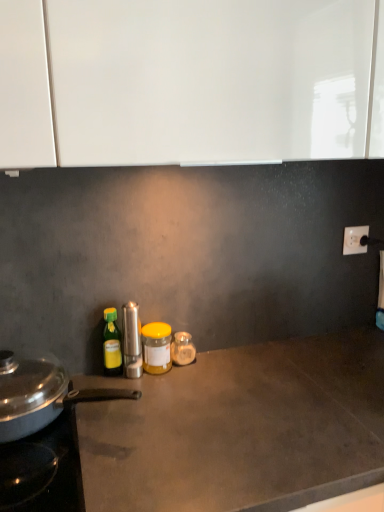
What do you see at coordinates (235, 430) in the screenshot? I see `matte gray countertop at center` at bounding box center [235, 430].

Measure the distance between white plastic electric outlet at upper right and camera.

The distance of white plastic electric outlet at upper right from camera is 4.56 feet.

Identify the location of green plastic bottle at left, the 1th bottle viewed from the left. (111, 343).

From a real-world perspective, is satin silver pepper mill at center, the 1th kitchen appliance positioned from the right, located beneath translucent glass jar at center, arranged as the third bottle when viewed from the left?

Actually, satin silver pepper mill at center, the 1th kitchen appliance positioned from the right, is physically above translucent glass jar at center, arranged as the third bottle when viewed from the left, in the real world.

Is satin silver pepper mill at center, the 2th kitchen appliance in the left-to-right sequence, situated inside translucent glass jar at center, marked as the first bottle in a right-to-left arrangement, or outside?

satin silver pepper mill at center, the 2th kitchen appliance in the left-to-right sequence, is outside translucent glass jar at center, marked as the first bottle in a right-to-left arrangement.

Could you tell me if satin silver pepper mill at center, the 2th kitchen appliance in the left-to-right sequence, is turned towards translucent glass jar at center, marked as the first bottle in a right-to-left arrangement?

No, satin silver pepper mill at center, the 2th kitchen appliance in the left-to-right sequence, is not oriented towards translucent glass jar at center, marked as the first bottle in a right-to-left arrangement.

Is yellow matte jar at center, which is the 2th bottle from right to left, at the back of translucent glass jar at center, marked as the first bottle in a right-to-left arrangement?

No, translucent glass jar at center, marked as the first bottle in a right-to-left arrangement, is not facing the opposite direction of yellow matte jar at center, which is the 2th bottle from right to left.

Looking at the image, does translucent glass jar at center, arranged as the third bottle when viewed from the left, seem bigger or smaller compared to yellow matte jar at center, which ranks as the second bottle in left-to-right order?

Clearly, translucent glass jar at center, arranged as the third bottle when viewed from the left, is smaller in size than yellow matte jar at center, which ranks as the second bottle in left-to-right order.

Is point (182, 358) positioned behind point (147, 340)?

Yes.

In the scene shown: Is the surface of metallic silver pan at left, the 2th kitchen appliance viewed from the right, in direct contact with white plastic electric outlet at upper right?

They are not placed beside each other.

From the image's perspective, which is above, metallic silver pan at left, which appears as the first kitchen appliance when viewed from the left, or white plastic electric outlet at upper right?

From the image's view, white plastic electric outlet at upper right is above.

Is metallic silver pan at left, the 2th kitchen appliance viewed from the right, positioned with its back to white plastic electric outlet at upper right?

No, metallic silver pan at left, the 2th kitchen appliance viewed from the right, is not facing away from white plastic electric outlet at upper right.

Is metallic silver pan at left, the 2th kitchen appliance viewed from the right, located outside white plastic electric outlet at upper right?

Yes.

Starting from the satin silver pepper mill at center, the 1th kitchen appliance positioned from the right, which bottle is the 1st one to the right? Please provide its 2D coordinates.

[(156, 347)]

Between satin silver pepper mill at center, the 1th kitchen appliance positioned from the right, and yellow matte jar at center, which ranks as the second bottle in left-to-right order, which one has larger width?

yellow matte jar at center, which ranks as the second bottle in left-to-right order, is wider.

Is satin silver pepper mill at center, the 1th kitchen appliance positioned from the right, inside or outside of yellow matte jar at center, which is the 2th bottle from right to left?

The correct answer is: outside.

Consider the image. From the image's perspective, is metallic silver pan at left, the 2th kitchen appliance viewed from the right, below matte gray countertop at center?

No, from the image's perspective, metallic silver pan at left, the 2th kitchen appliance viewed from the right, is not beneath matte gray countertop at center.

Where is `countertop that appears in front of the metallic silver pan at left, the 2th kitchen appliance viewed from the right`? The width and height of the screenshot is (384, 512). countertop that appears in front of the metallic silver pan at left, the 2th kitchen appliance viewed from the right is located at coordinates (235, 430).

Considering the relative sizes of metallic silver pan at left, the 2th kitchen appliance viewed from the right, and matte gray countertop at center in the image provided, is metallic silver pan at left, the 2th kitchen appliance viewed from the right, taller than matte gray countertop at center?

No, metallic silver pan at left, the 2th kitchen appliance viewed from the right, is not taller than matte gray countertop at center.

Is white plastic electric outlet at upper right at the back of yellow matte jar at center, which ranks as the second bottle in left-to-right order?

No, yellow matte jar at center, which ranks as the second bottle in left-to-right order, is not facing away from white plastic electric outlet at upper right.

From a real-world perspective, between yellow matte jar at center, which ranks as the second bottle in left-to-right order, and white plastic electric outlet at upper right, who is vertically higher?

white plastic electric outlet at upper right is physically above.

Is yellow matte jar at center, which is the 2th bottle from right to left, taller than white plastic electric outlet at upper right?

Yes.

From a real-world perspective, between white plastic electric outlet at upper right and satin silver pepper mill at center, the 1th kitchen appliance positioned from the right, who is vertically higher?

white plastic electric outlet at upper right, from a real-world perspective.

How many degrees apart are the facing directions of white plastic electric outlet at upper right and satin silver pepper mill at center, the 1th kitchen appliance positioned from the right?

white plastic electric outlet at upper right and satin silver pepper mill at center, the 1th kitchen appliance positioned from the right, are facing 5.01 degrees away from each other.

Is white plastic electric outlet at upper right inside the boundaries of satin silver pepper mill at center, the 2th kitchen appliance in the left-to-right sequence, or outside?

white plastic electric outlet at upper right cannot be found inside satin silver pepper mill at center, the 2th kitchen appliance in the left-to-right sequence.

Considering the points (348, 248) and (126, 371), which point is in front, point (348, 248) or point (126, 371)?

Point (126, 371)

At what (x,y) coordinates should I click in order to perform the action: click on the 1st kitchen appliance in front of the translucent glass jar at center, marked as the first bottle in a right-to-left arrangement, counting from the anchor's position. Please return your answer as a coordinate pair (x, y). Image resolution: width=384 pixels, height=512 pixels. Looking at the image, I should click on (131, 340).

This screenshot has width=384, height=512. I want to click on bottle that appears on the right of yellow matte jar at center, which ranks as the second bottle in left-to-right order, so tap(182, 348).

Looking at the image, which one is located closer to metallic silver pan at left, which appears as the first kitchen appliance when viewed from the left, matte gray countertop at center or satin silver pepper mill at center, the 2th kitchen appliance in the left-to-right sequence?

matte gray countertop at center is positioned closer to the anchor metallic silver pan at left, which appears as the first kitchen appliance when viewed from the left.

When comparing their distances from matte gray countertop at center, does translucent glass jar at center, arranged as the third bottle when viewed from the left, or satin silver pepper mill at center, the 2th kitchen appliance in the left-to-right sequence, seem further?

The object further to matte gray countertop at center is satin silver pepper mill at center, the 2th kitchen appliance in the left-to-right sequence.

When comparing their distances from green plastic bottle at left, the 1th bottle viewed from the left, does satin silver pepper mill at center, the 1th kitchen appliance positioned from the right, or matte gray countertop at center seem further?

matte gray countertop at center is positioned further to the anchor green plastic bottle at left, the 1th bottle viewed from the left.

Based on their spatial positions, is yellow matte jar at center, which is the 2th bottle from right to left, or white plastic electric outlet at upper right closer to matte gray countertop at center?

yellow matte jar at center, which is the 2th bottle from right to left, is positioned closer to the anchor matte gray countertop at center.

When comparing their distances from white plastic electric outlet at upper right, does yellow matte jar at center, which is the 2th bottle from right to left, or satin silver pepper mill at center, the 1th kitchen appliance positioned from the right, seem closer?

yellow matte jar at center, which is the 2th bottle from right to left, lies closer to white plastic electric outlet at upper right than the other object.

Considering their positions, is matte gray countertop at center positioned closer to satin silver pepper mill at center, the 2th kitchen appliance in the left-to-right sequence, than translucent glass jar at center, marked as the first bottle in a right-to-left arrangement?

Among the two, translucent glass jar at center, marked as the first bottle in a right-to-left arrangement, is located nearer to satin silver pepper mill at center, the 2th kitchen appliance in the left-to-right sequence.

Considering their positions, is metallic silver pan at left, which appears as the first kitchen appliance when viewed from the left, positioned further to green plastic bottle at left, the 1th bottle viewed from the left, than yellow matte jar at center, which ranks as the second bottle in left-to-right order?

metallic silver pan at left, which appears as the first kitchen appliance when viewed from the left, is positioned further to the anchor green plastic bottle at left, the 1th bottle viewed from the left.

Looking at the image, which one is located further to metallic silver pan at left, which appears as the first kitchen appliance when viewed from the left, yellow matte jar at center, which is the 2th bottle from right to left, or matte gray countertop at center?

Among the two, yellow matte jar at center, which is the 2th bottle from right to left, is located further to metallic silver pan at left, which appears as the first kitchen appliance when viewed from the left.

You are a GUI agent. You are given a task and a screenshot of the screen. Output one action in this format:
    pyautogui.click(x=<x>, y=<y>)
    Task: Click on the kitchen appliance between green plastic bottle at left, the 3th bottle positioned from the right, and matte gray countertop at center, in the vertical direction
    This screenshot has height=512, width=384.
    Given the screenshot: What is the action you would take?
    pyautogui.click(x=40, y=395)

The height and width of the screenshot is (512, 384). Find the location of `kitchen appliance between satin silver pepper mill at center, the 1th kitchen appliance positioned from the right, and matte gray countertop at center from top to bottom`. kitchen appliance between satin silver pepper mill at center, the 1th kitchen appliance positioned from the right, and matte gray countertop at center from top to bottom is located at coordinates (40, 395).

This screenshot has width=384, height=512. Find the location of `bottle between matte gray countertop at center and green plastic bottle at left, the 3th bottle positioned from the right, in the front-back direction`. bottle between matte gray countertop at center and green plastic bottle at left, the 3th bottle positioned from the right, in the front-back direction is located at coordinates (156, 347).

Where is `kitchen appliance between green plastic bottle at left, the 3th bottle positioned from the right, and yellow matte jar at center, which is the 2th bottle from right to left`? The image size is (384, 512). kitchen appliance between green plastic bottle at left, the 3th bottle positioned from the right, and yellow matte jar at center, which is the 2th bottle from right to left is located at coordinates click(131, 340).